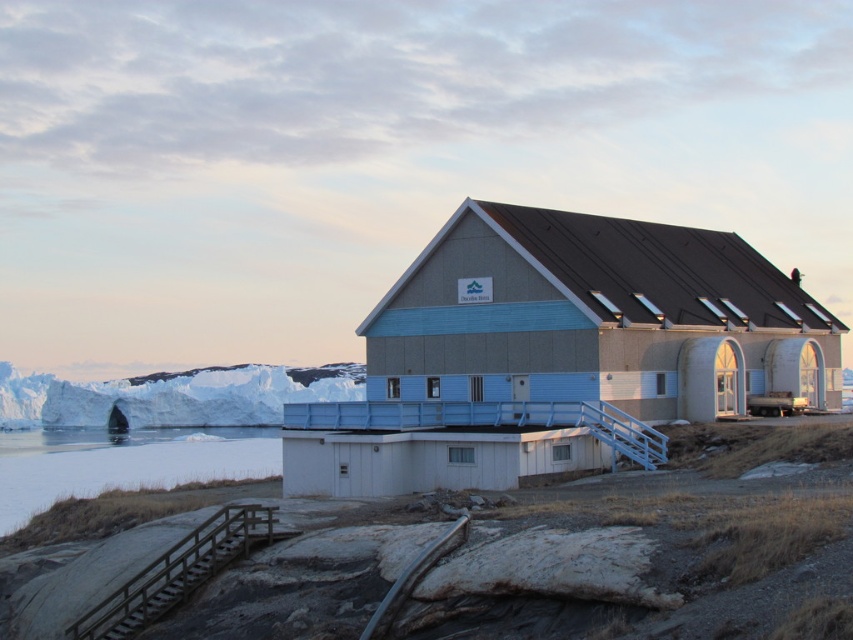
Is wooden at lower left smaller than metallic silver rail at lower center?

Correct, wooden at lower left occupies less space than metallic silver rail at lower center.

Which is behind, point (221, 547) or point (396, 580)?

The point (221, 547) is behind.

Where is `wooden at lower left`? wooden at lower left is located at coordinates (178, 572).

What do you see at coordinates (122, 461) in the screenshot? The image size is (853, 640). I see `white ice at lower left` at bounding box center [122, 461].

The height and width of the screenshot is (640, 853). What do you see at coordinates (122, 461) in the screenshot?
I see `white ice at lower left` at bounding box center [122, 461].

At what (x,y) coordinates should I click in order to perform the action: click on white ice at lower left. Please return your answer as a coordinate pair (x, y). The height and width of the screenshot is (640, 853). Looking at the image, I should click on (122, 461).

Does blue painted wood hut at center have a greater width compared to white ice at lower left?

No, blue painted wood hut at center is not wider than white ice at lower left.

Who is taller, blue painted wood hut at center or white ice at lower left?

With more height is blue painted wood hut at center.

This screenshot has height=640, width=853. Describe the element at coordinates (556, 353) in the screenshot. I see `blue painted wood hut at center` at that location.

The height and width of the screenshot is (640, 853). What are the coordinates of `blue painted wood hut at center` in the screenshot? It's located at (556, 353).